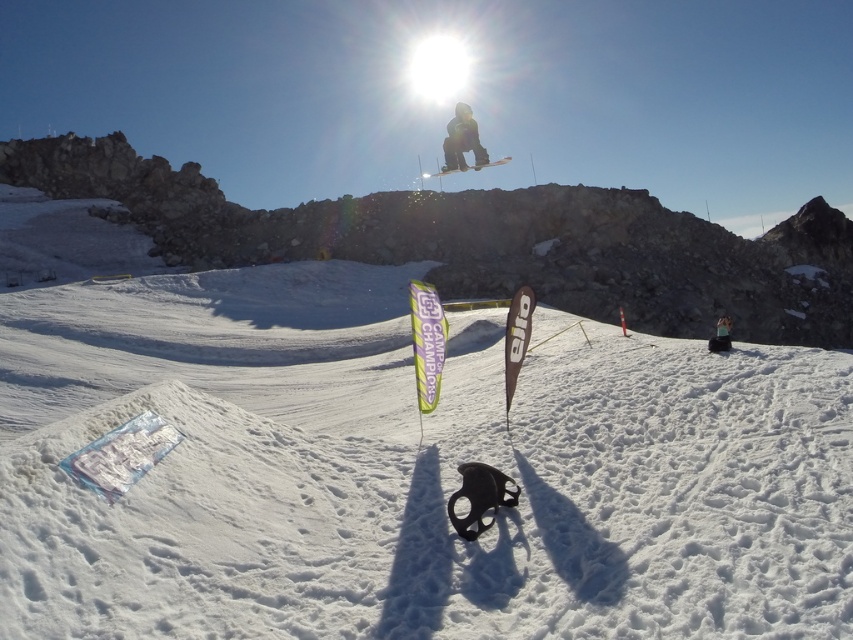
Question: Is the position of matte black snowboarder at center less distant than that of smooth black snowboarder at center?

Choices:
 (A) yes
 (B) no

Answer: (B)

Question: Which of the following is the closest to the observer?

Choices:
 (A) (437, 177)
 (B) (822, 205)

Answer: (B)

Question: Which is nearer to the white powder snow at center?

Choices:
 (A) white matte snowboard at center
 (B) black matte snowboarder at center
 (C) smooth black snowboarder at center

Answer: (C)

Question: Is black matte snowboarder at center positioned before smooth black snowboarder at center?

Choices:
 (A) yes
 (B) no

Answer: (B)

Question: Is matte black snowboarder at center to the left of smooth black snowboarder at center from the viewer's perspective?

Choices:
 (A) yes
 (B) no

Answer: (A)

Question: Among these points, which one is farthest from the camera?

Choices:
 (A) (718, 346)
 (B) (463, 161)
 (C) (628, 404)
 (D) (457, 150)

Answer: (D)